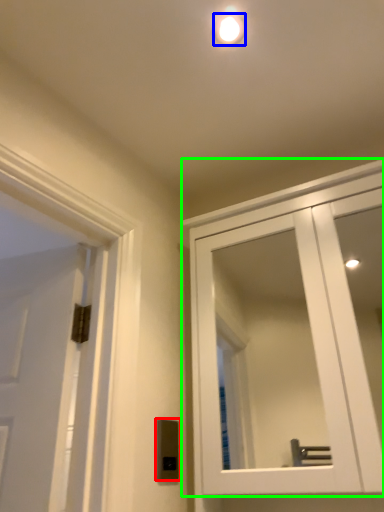
Question: Estimate the real-world distances between objects in this image. Which object is farther from light switch (highlighted by a red box), droplight (highlighted by a blue box) or cabinetry (highlighted by a green box)?

Choices:
 (A) droplight
 (B) cabinetry

Answer: (B)